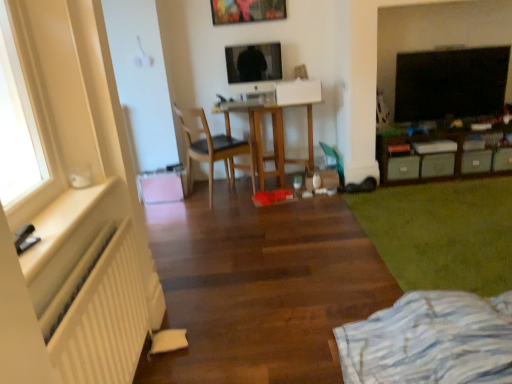
Question: Does black glossy tv at upper right have a lesser width compared to white matte radiator at left?

Choices:
 (A) yes
 (B) no

Answer: (A)

Question: Can you confirm if black glossy tv at upper right is shorter than white matte radiator at left?

Choices:
 (A) yes
 (B) no

Answer: (A)

Question: From a real-world perspective, is black glossy tv at upper right on white matte radiator at left?

Choices:
 (A) no
 (B) yes

Answer: (A)

Question: From the image's perspective, is black glossy tv at upper right over white matte radiator at left?

Choices:
 (A) yes
 (B) no

Answer: (A)

Question: Is black glossy tv at upper right at the right side of white matte radiator at left?

Choices:
 (A) no
 (B) yes

Answer: (B)

Question: In the image, is white striped fabric at lower right positioned in front of or behind white wooden window sill at left?

Choices:
 (A) front
 (B) behind

Answer: (B)

Question: Is white striped fabric at lower right to the left or to the right of white wooden window sill at left in the image?

Choices:
 (A) left
 (B) right

Answer: (B)

Question: From their relative heights in the image, would you say white striped fabric at lower right is taller or shorter than white wooden window sill at left?

Choices:
 (A) tall
 (B) short

Answer: (A)

Question: Considering the positions of white striped fabric at lower right and white wooden window sill at left in the image, is white striped fabric at lower right wider or thinner than white wooden window sill at left?

Choices:
 (A) wide
 (B) thin

Answer: (A)

Question: From a real-world perspective, is green matte drawer at right, which ranks as the 3th drawer in left-to-right order, above or below light brown wooden chair at center?

Choices:
 (A) above
 (B) below

Answer: (B)

Question: From the image's perspective, is green matte drawer at right, which appears as the 2th drawer when viewed from the right, located above or below light brown wooden chair at center?

Choices:
 (A) above
 (B) below

Answer: (B)

Question: Looking at the image, does green matte drawer at right, which appears as the 2th drawer when viewed from the right, seem bigger or smaller compared to light brown wooden chair at center?

Choices:
 (A) big
 (B) small

Answer: (B)

Question: Considering their positions, is green matte drawer at right, which ranks as the 3th drawer in left-to-right order, located in front of or behind light brown wooden chair at center?

Choices:
 (A) behind
 (B) front

Answer: (A)

Question: Relative to green matte storage unit at right, is white matte radiator at left in front or behind?

Choices:
 (A) behind
 (B) front

Answer: (B)

Question: In terms of height, does white matte radiator at left look taller or shorter compared to green matte storage unit at right?

Choices:
 (A) short
 (B) tall

Answer: (B)